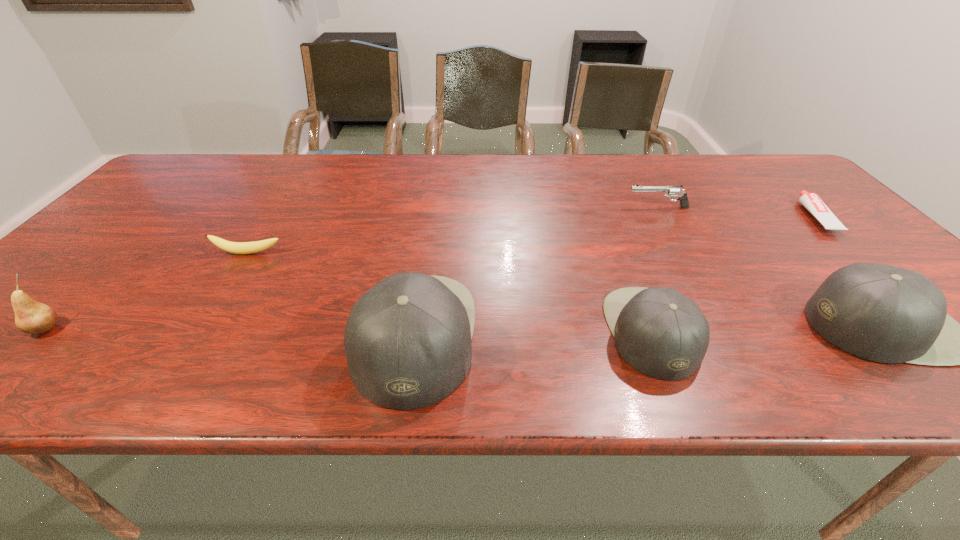
Image resolution: width=960 pixels, height=540 pixels. What are the coordinates of `the third object from left to right` in the screenshot? It's located at (408, 340).

Find the location of a particular element. The image size is (960, 540). the shortest cap is located at coordinates (658, 331).

Locate an element on the screen. the shortest object is located at coordinates (811, 201).

Image resolution: width=960 pixels, height=540 pixels. In order to click on banana in this screenshot , I will do `click(232, 247)`.

You are a GUI agent. You are given a task and a screenshot of the screen. Output one action in this format:
    pyautogui.click(x=<x>, y=<y>)
    Task: Click on the fifth nearest object
    The image size is (960, 540).
    Given the screenshot: What is the action you would take?
    (x=232, y=247)

At what (x,y) coordinates should I click in order to perform the action: click on pistol. Please return your answer as a coordinate pair (x, y). The width and height of the screenshot is (960, 540). Looking at the image, I should click on (669, 191).

The image size is (960, 540). I want to click on the leftmost object, so click(31, 317).

The width and height of the screenshot is (960, 540). I want to click on free space located 0.210m on the brim of the third object from left to right, so click(x=579, y=336).

The height and width of the screenshot is (540, 960). Find the location of `vacant region located 0.270m on the brim of the second cap from left to right`. vacant region located 0.270m on the brim of the second cap from left to right is located at coordinates (826, 331).

Where is `vacant space situated on the left of the shortest object`? The image size is (960, 540). vacant space situated on the left of the shortest object is located at coordinates (753, 216).